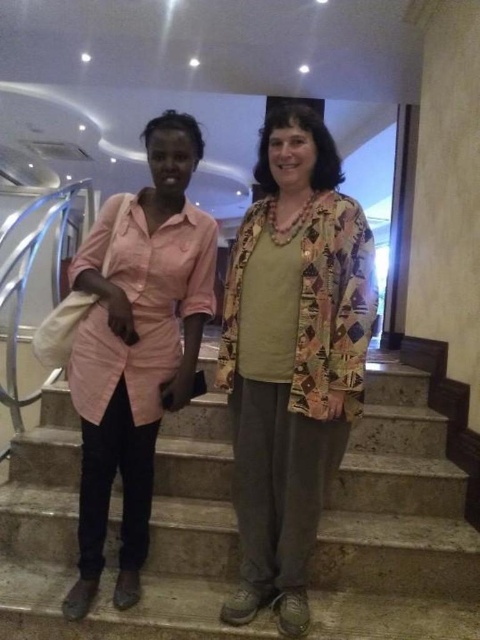
Question: Which is nearer to the pink fabric shirt at center?

Choices:
 (A) pink cotton shirt at left
 (B) gray concrete stairs at center

Answer: (A)

Question: Which of the following is the farthest from the observer?

Choices:
 (A) pink cotton shirt at left
 (B) pink fabric shirt at center

Answer: (B)

Question: Does gray concrete stairs at center have a smaller size compared to pink cotton shirt at left?

Choices:
 (A) yes
 (B) no

Answer: (B)

Question: Among these points, which one is nearest to the camera?

Choices:
 (A) (324, 488)
 (B) (98, 230)
 (C) (47, 484)

Answer: (A)

Question: Is gray concrete stairs at center positioned in front of pink cotton shirt at left?

Choices:
 (A) no
 (B) yes

Answer: (A)

Question: Observing the image, what is the correct spatial positioning of gray concrete stairs at center in reference to pink cotton shirt at left?

Choices:
 (A) above
 (B) below

Answer: (B)